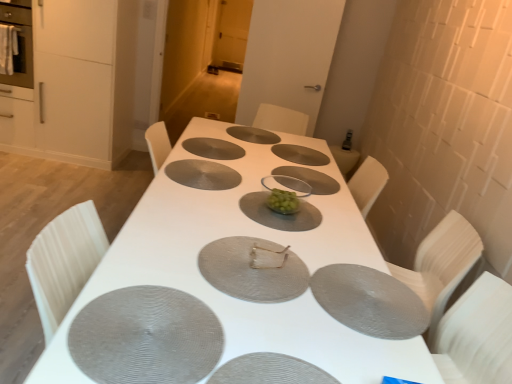
This screenshot has height=384, width=512. What are the coordinates of `empty space that is in between matte gray pizza pan at center, which appears as the sixth pizza pan when viewed from the front, and metallic silver napkin at center` in the screenshot? It's located at (226, 186).